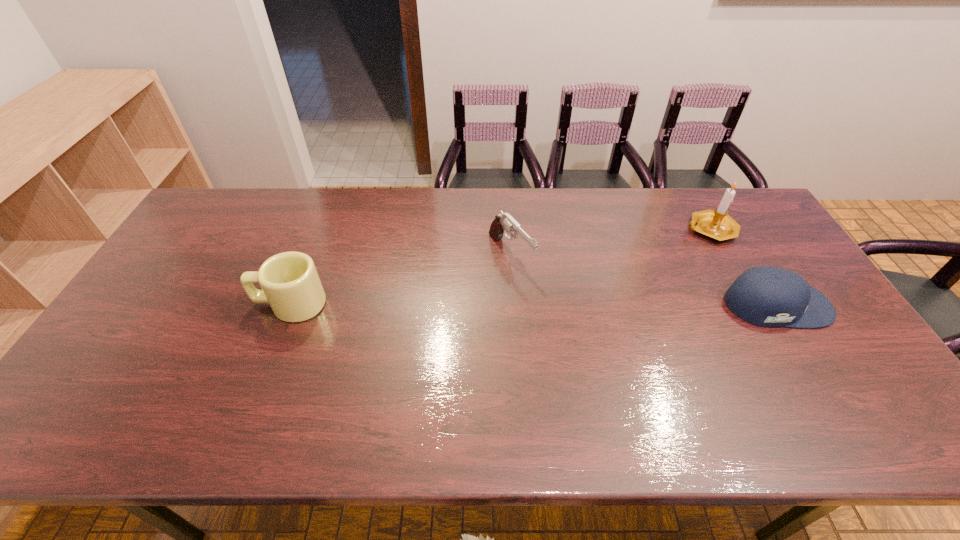
This screenshot has height=540, width=960. I want to click on vacant space positioned with a handle on the tallest object, so click(x=651, y=269).

Where is `vacant space located 0.200m with a handle on the tallest object`? This screenshot has height=540, width=960. vacant space located 0.200m with a handle on the tallest object is located at coordinates (655, 266).

Where is `vacant point located with a handle on the tallest object`? vacant point located with a handle on the tallest object is located at coordinates (625, 287).

This screenshot has width=960, height=540. I want to click on object that is at the far edge, so click(716, 224).

Locate an element on the screen. Image resolution: width=960 pixels, height=540 pixels. baseball cap that is positioned at the right edge is located at coordinates (767, 296).

Identify the location of candle holder that is at the right edge. (716, 224).

Identify the location of object situated at the far right corner. (716, 224).

Where is `vacant space at the far edge`? Image resolution: width=960 pixels, height=540 pixels. vacant space at the far edge is located at coordinates (330, 191).

In the image, there is a desktop. At what (x,y) coordinates should I click in order to perform the action: click on vacant space at the near edge. Please return your answer as a coordinate pair (x, y). The height and width of the screenshot is (540, 960). Looking at the image, I should click on (349, 371).

In the image, there is a desktop. Where is `free space at the left edge`? The width and height of the screenshot is (960, 540). free space at the left edge is located at coordinates (139, 337).